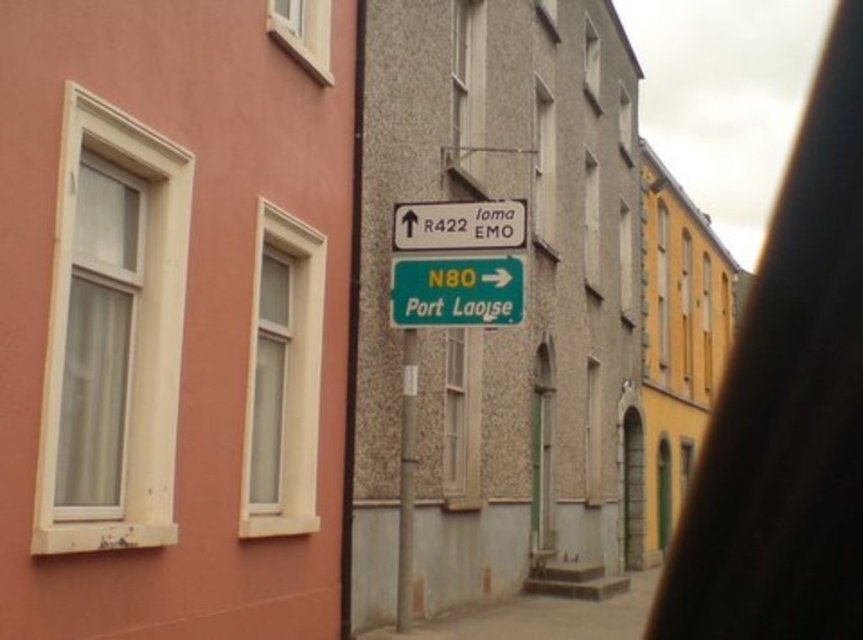
You are standing at the point marked by the coordinates point [545,612] in the image. Looking around, you see the pink building with light colored window frame on the left and the gray building with textured on the right. Which direction should you face to see the gray concrete alley at center?

The point [545,612] corresponds to the gray concrete alley at center. Facing towards the gray building with textured on the right would allow you to see the gray concrete alley at center.